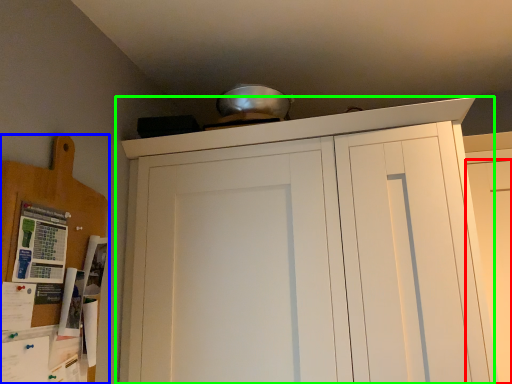
Question: Which is nearer to the door (highlighted by a red box)? cabinetry (highlighted by a blue box) or cupboard (highlighted by a green box).

Choices:
 (A) cabinetry
 (B) cupboard

Answer: (B)